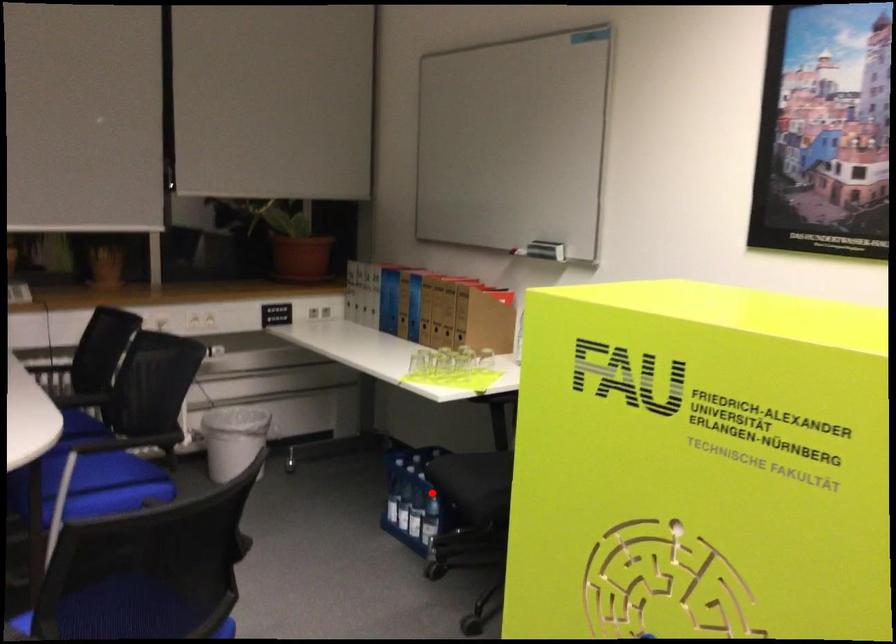
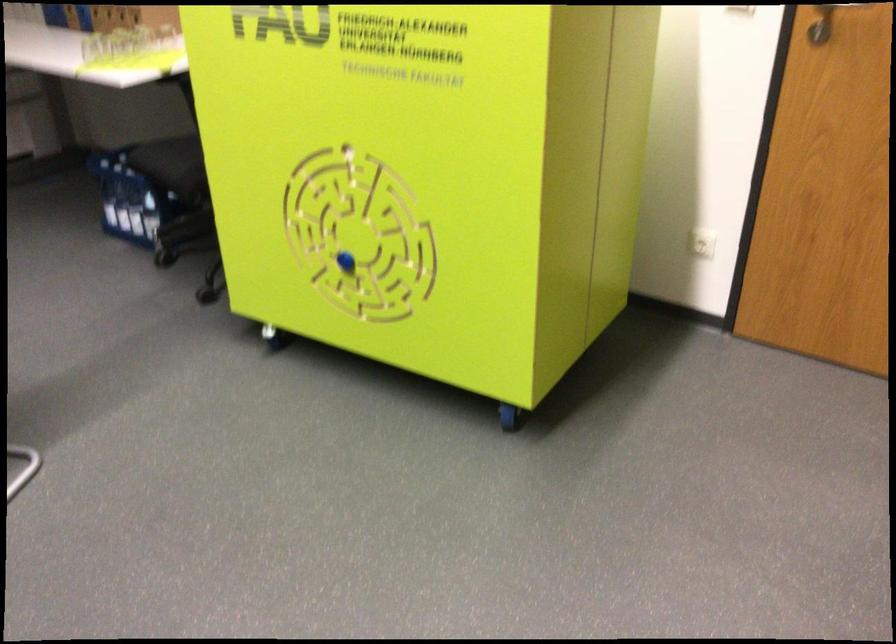
Where in the second image is the point corresponding to the highlighted location from the first image?

(149, 185)